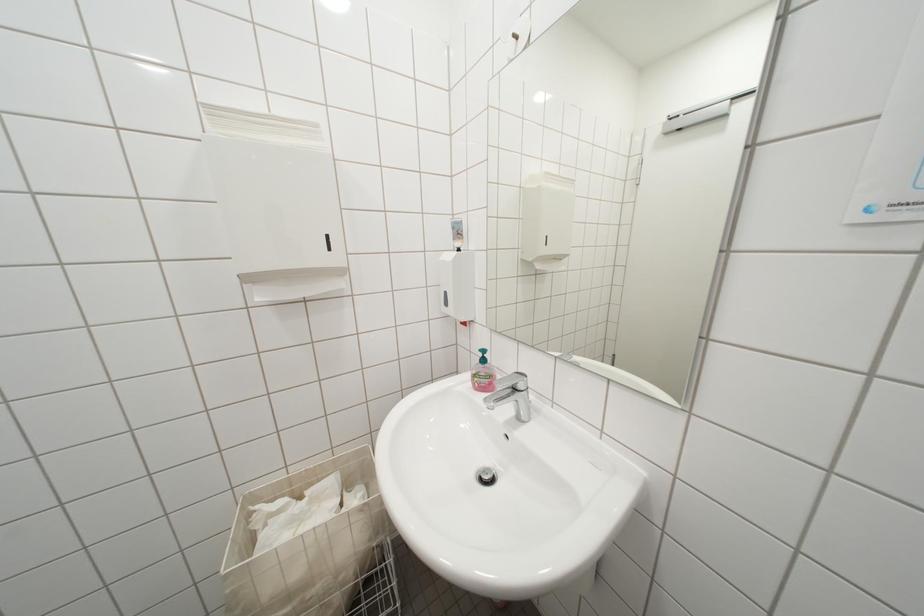
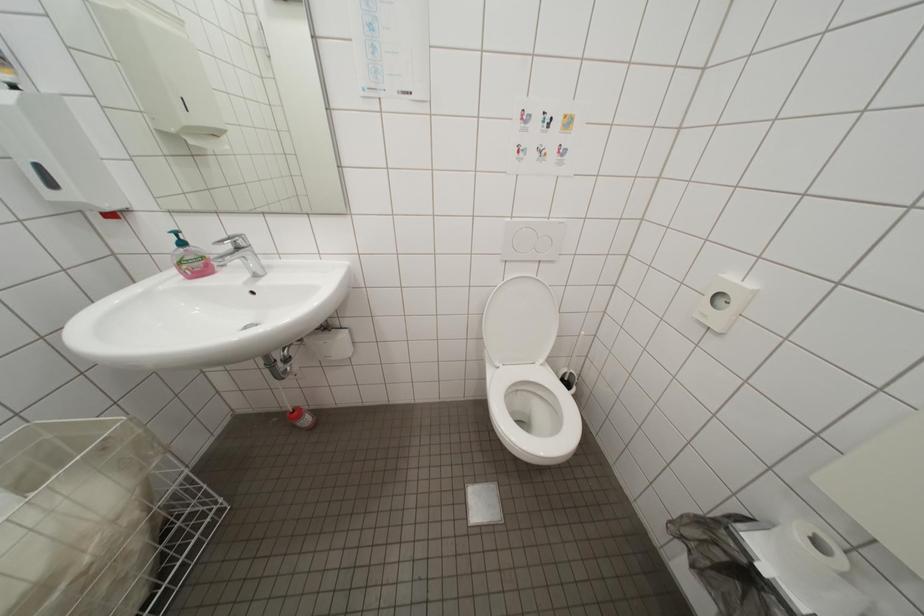
Based on the continuous images, in which direction is the camera rotating?

The rotation direction of the camera is right-down.